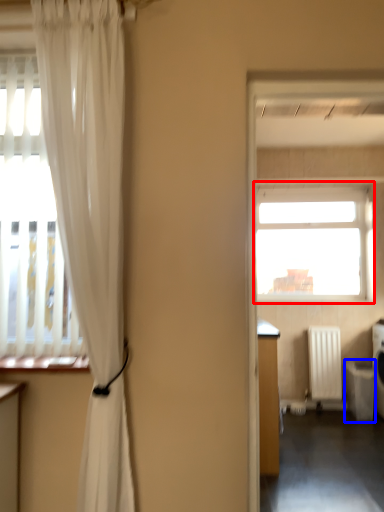
Question: Which object appears closest to the camera in this image, window (highlighted by a red box) or dish washer (highlighted by a blue box)?

Choices:
 (A) window
 (B) dish washer

Answer: (B)